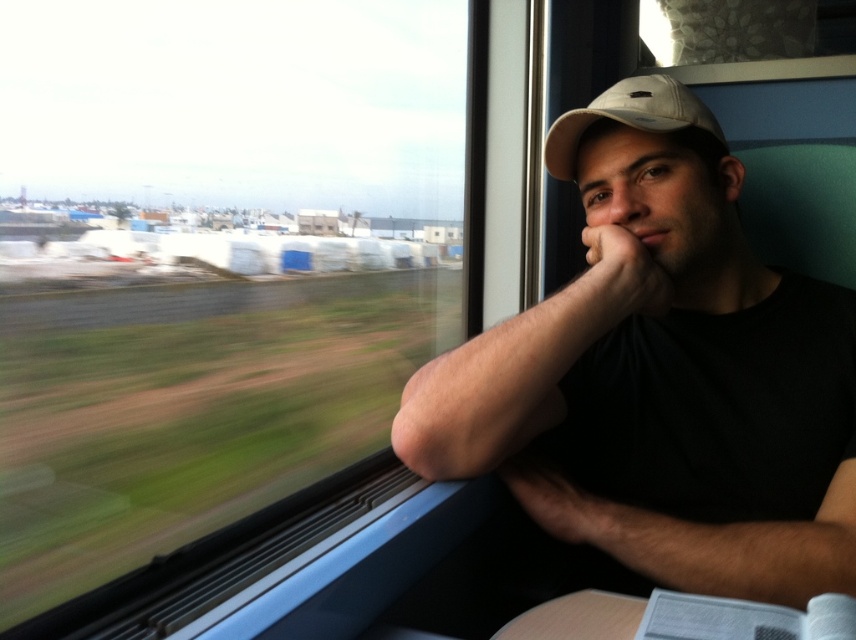
Is transparent glass train window at upper left bigger than beige fabric cap at upper right?

Correct, transparent glass train window at upper left is larger in size than beige fabric cap at upper right.

Between point (440, 180) and point (795, 346), which one is positioned behind?

The point (440, 180) is more distant.

Who is more distant from viewer, [449,256] or [580,314]?

Positioned behind is point [449,256].

Locate an element on the screen. transparent glass train window at upper left is located at coordinates (209, 262).

Does point (27, 221) come in front of point (545, 148)?

No, (27, 221) is further to viewer.

Based on the photo, which of these two, transparent glass train window at upper left or white matte baseball cap at upper right, stands taller?

Standing taller between the two is transparent glass train window at upper left.

Where is `transparent glass train window at upper left`? The height and width of the screenshot is (640, 856). transparent glass train window at upper left is located at coordinates (209, 262).

Does beige fabric cap at upper right lie behind white matte baseball cap at upper right?

No, beige fabric cap at upper right is closer to the viewer.

Is beige fabric cap at upper right to the right of white matte baseball cap at upper right from the viewer's perspective?

Yes, beige fabric cap at upper right is to the right of white matte baseball cap at upper right.

Identify the location of beige fabric cap at upper right. This screenshot has height=640, width=856. (657, 365).

Where is `beige fabric cap at upper right`? The image size is (856, 640). beige fabric cap at upper right is located at coordinates (657, 365).